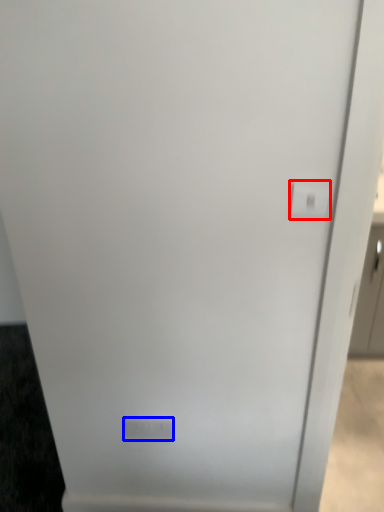
Question: Which object appears closest to the camera in this image, light switch (highlighted by a red box) or light switch (highlighted by a blue box)?

Choices:
 (A) light switch
 (B) light switch

Answer: (A)